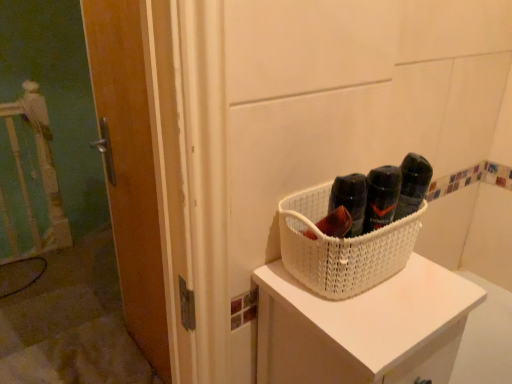
Identify the location of empty space that is ontop of white woven basket at upper right (from a real-world perspective). Image resolution: width=512 pixels, height=384 pixels. (389, 297).